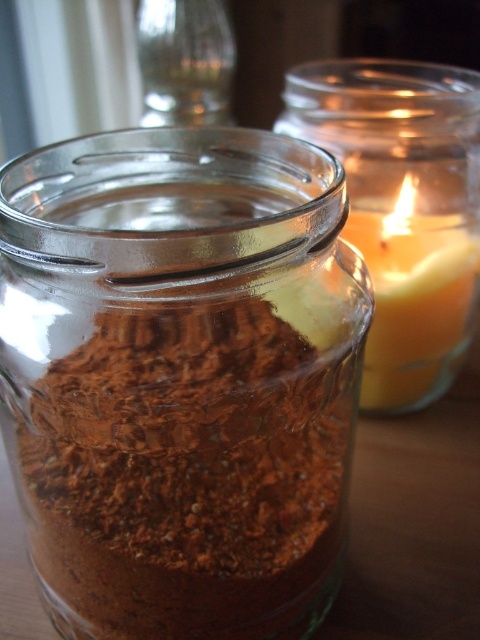
From the picture: You are a delivery person who needs to place a new jar of spices that is 12 inches in height onto the wooden surface. Considering the current arrangement of the yellow wax candle at right and the transparent glass jar at upper center, will there be enough space between them to safely place the new jar without knocking anything over?

The distance between the yellow wax candle at right and the transparent glass jar at upper center is 14.25 inches. Since the new jar is 12 inches tall, there is sufficient space between them to place the new jar safely without causing any items to fall over.

You are looking at two points on the wooden surface where the jars are placed. The first point is at coordinates point (160, 392) and the second is at point (225, 33). Which point is closer to you?

Point (160, 392) is closer to you because it is in front of point (225, 33).